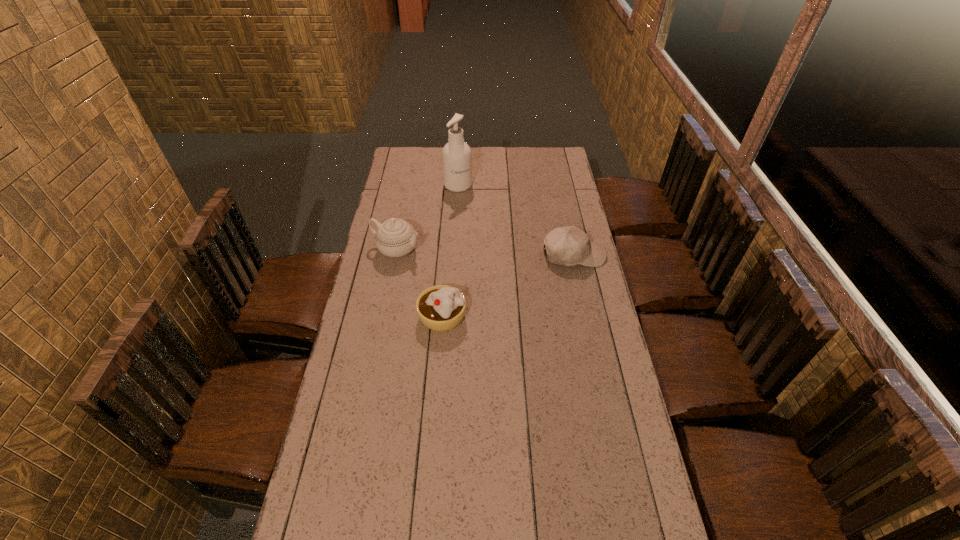
Locate an element on the screen. This screenshot has height=540, width=960. free space located on the spout of the leftmost object is located at coordinates (440, 263).

Where is `vacant space located on the spout of the leftmost object`? The width and height of the screenshot is (960, 540). vacant space located on the spout of the leftmost object is located at coordinates tap(446, 265).

I want to click on vacant point located 0.330m on the spout of the leftmost object, so (x=492, y=281).

Identify the location of object at the left edge. (395, 237).

Find the location of a particular element. The height and width of the screenshot is (540, 960). object at the right edge is located at coordinates (569, 245).

This screenshot has height=540, width=960. What are the coordinates of `vacant space at the far edge of the desktop` in the screenshot? It's located at (505, 160).

Find the location of a particular element. Image resolution: width=960 pixels, height=540 pixels. free space at the near edge of the desktop is located at coordinates (574, 512).

You are a GUI agent. You are given a task and a screenshot of the screen. Output one action in this format:
    pyautogui.click(x=<x>, y=<y>)
    Task: Click on the vacant space at the left edge of the desktop
    The height and width of the screenshot is (540, 960).
    Given the screenshot: What is the action you would take?
    pyautogui.click(x=386, y=284)

I want to click on vacant region at the right edge, so click(599, 402).

At what (x,y) coordinates should I click in order to perform the action: click on vacant region at the far right corner of the desktop. Please return your answer as a coordinate pair (x, y). Looking at the image, I should click on (536, 158).